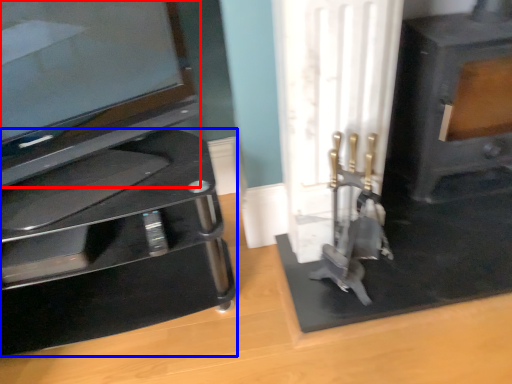
Question: Which of the following is the closest to the observer, television (highlighted by a red box) or furniture (highlighted by a blue box)?

Choices:
 (A) television
 (B) furniture

Answer: (A)